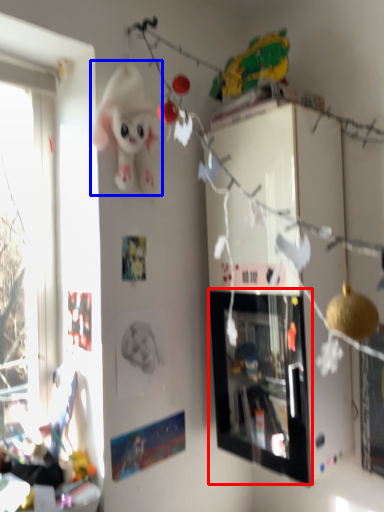
Question: Which object appears closest to the camera in this image, picture frame (highlighted by a red box) or toy (highlighted by a blue box)?

Choices:
 (A) picture frame
 (B) toy

Answer: (B)